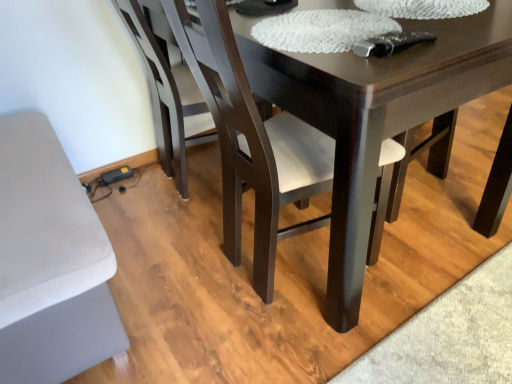
Question: From a real-world perspective, is dark wood chair at lower left, the 2th chair when ordered from front to back, positioned above or below dark wood chair at center, positioned as the first chair in front-to-back order?

Choices:
 (A) below
 (B) above

Answer: (A)

Question: From the image's perspective, is dark wood chair at lower left, which ranks as the first chair in back-to-front order, located above or below dark wood chair at center, positioned as the first chair in front-to-back order?

Choices:
 (A) above
 (B) below

Answer: (A)

Question: Is dark wood chair at lower left, the 2th chair when ordered from front to back, inside the boundaries of dark wood chair at center, positioned as the second chair in back-to-front order, or outside?

Choices:
 (A) inside
 (B) outside

Answer: (B)

Question: From the image's perspective, is dark wood chair at center, positioned as the first chair in front-to-back order, positioned above or below dark wood chair at lower left, the 2th chair when ordered from front to back?

Choices:
 (A) below
 (B) above

Answer: (A)

Question: Considering the positions of dark wood chair at center, positioned as the first chair in front-to-back order, and dark wood chair at lower left, the 2th chair when ordered from front to back, in the image, is dark wood chair at center, positioned as the first chair in front-to-back order, taller or shorter than dark wood chair at lower left, the 2th chair when ordered from front to back,?

Choices:
 (A) tall
 (B) short

Answer: (A)

Question: Would you say dark wood chair at center, positioned as the first chair in front-to-back order, is inside or outside dark wood chair at lower left, the 2th chair when ordered from front to back?

Choices:
 (A) outside
 (B) inside

Answer: (A)

Question: Would you say dark wood chair at center, positioned as the first chair in front-to-back order, is to the left or to the right of dark wood chair at lower left, which ranks as the first chair in back-to-front order, in the picture?

Choices:
 (A) right
 (B) left

Answer: (A)